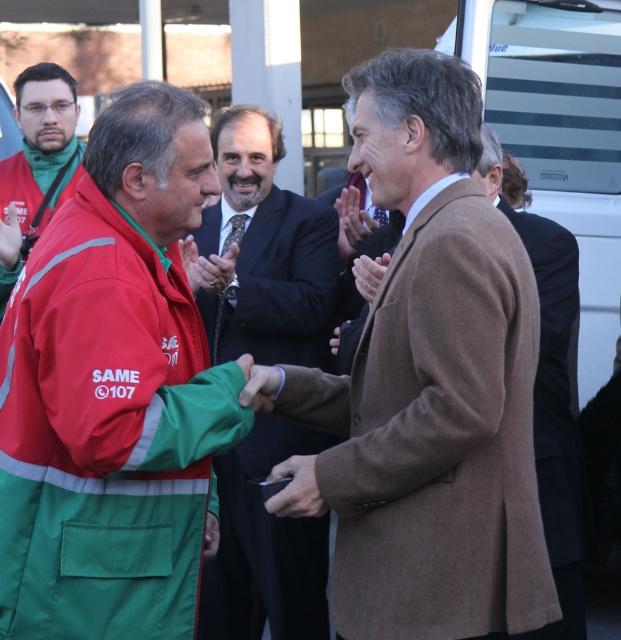
Between point (573, 305) and point (70, 80), which one is positioned behind?

The point (70, 80) is more distant.

Does point (546, 352) lie behind point (17, 221)?

That is False.

Image resolution: width=621 pixels, height=640 pixels. Find the location of `brown wool coat at center`. brown wool coat at center is located at coordinates (550, 396).

How far apart are green fabric jacket at center and red reflective jacket at left?

green fabric jacket at center and red reflective jacket at left are 1.35 meters apart.

Does point (224, 580) come behind point (68, 140)?

That is False.

Who is more forward, (265,276) or (7,211)?

Point (265,276)

Locate an element on the screen. The height and width of the screenshot is (640, 621). green fabric jacket at center is located at coordinates [263, 250].

Is brown woolen coat at center shorter than green fabric jacket at center?

Yes.

Who is positioned more to the left, brown woolen coat at center or green fabric jacket at center?

green fabric jacket at center is more to the left.

Who is more distant from viewer, (355, 140) or (274, 628)?

The point (274, 628) is more distant.

The image size is (621, 640). What are the coordinates of `brown woolen coat at center` in the screenshot? It's located at (427, 385).